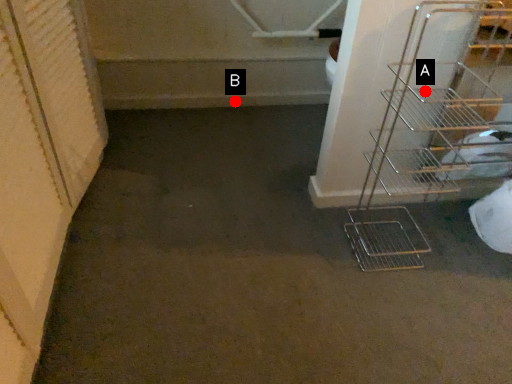
Question: Two points are circled on the image, labeled by A and B beside each circle. Among these points, which one is nearest to the camera?

Choices:
 (A) A is closer
 (B) B is closer

Answer: (A)